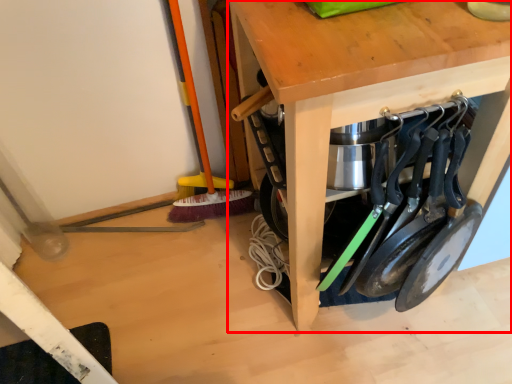
Question: Considering the relative positions of table (annotated by the red box) and tool in the image provided, where is table (annotated by the red box) located with respect to the staircase?

Choices:
 (A) left
 (B) right

Answer: (A)